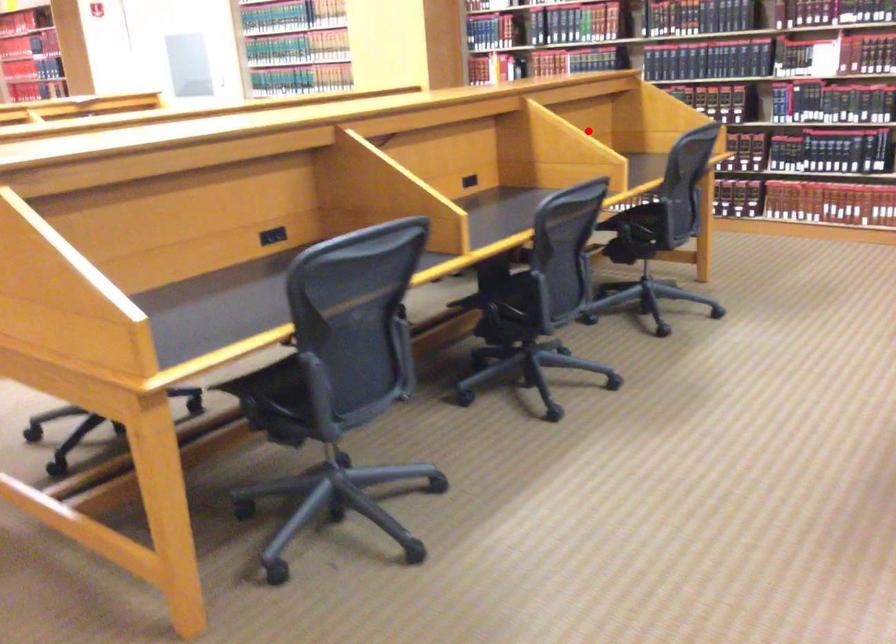
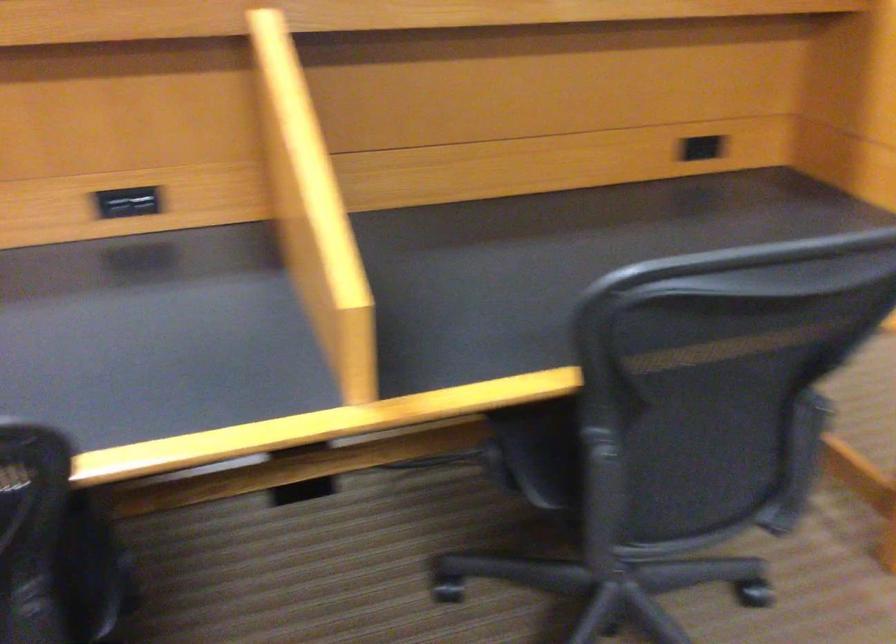
The point at the highlighted location is marked in the first image. Where is the corresponding point in the second image?

(702, 147)